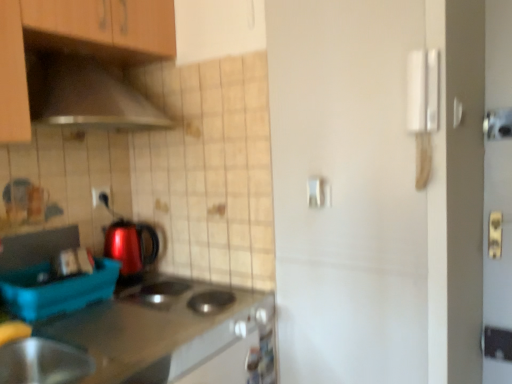
Question: Is metallic stainless steel countertop at lower left placed right next to matte black outlet at center?

Choices:
 (A) no
 (B) yes

Answer: (A)

Question: From a real-world perspective, is metallic stainless steel countertop at lower left positioned under matte black outlet at center based on gravity?

Choices:
 (A) yes
 (B) no

Answer: (A)

Question: Could you tell me if metallic stainless steel countertop at lower left is turned towards matte black outlet at center?

Choices:
 (A) yes
 (B) no

Answer: (B)

Question: From the image's perspective, is metallic stainless steel countertop at lower left on matte black outlet at center?

Choices:
 (A) yes
 (B) no

Answer: (B)

Question: Is metallic stainless steel countertop at lower left behind matte black outlet at center?

Choices:
 (A) yes
 (B) no

Answer: (B)

Question: From the image's perspective, relative to shiny plastic kettle at center-left, is white plastic door handle at upper right, the first door handle in the front-to-back sequence, above or below?

Choices:
 (A) below
 (B) above

Answer: (B)

Question: Based on their positions, is white plastic door handle at upper right, the first door handle in the front-to-back sequence, located to the left or right of shiny plastic kettle at center-left?

Choices:
 (A) left
 (B) right

Answer: (B)

Question: Is white plastic door handle at upper right, the 1th door handle positioned from the right, taller or shorter than shiny plastic kettle at center-left?

Choices:
 (A) short
 (B) tall

Answer: (B)

Question: Is white plastic door handle at upper right, the 2th door handle in the bottom-to-top sequence, inside or outside of shiny plastic kettle at center-left?

Choices:
 (A) outside
 (B) inside

Answer: (A)

Question: From a real-world perspective, is metallic stainless steel countertop at lower left physically located above or below white matte door handle at center, the 2th door handle positioned from the front?

Choices:
 (A) below
 (B) above

Answer: (A)

Question: Considering the positions of metallic stainless steel countertop at lower left and white matte door handle at center, the 1th door handle positioned from the bottom, in the image, is metallic stainless steel countertop at lower left wider or thinner than white matte door handle at center, the 1th door handle positioned from the bottom,?

Choices:
 (A) thin
 (B) wide

Answer: (B)

Question: Is metallic stainless steel countertop at lower left inside or outside of white matte door handle at center, the 2th door handle positioned from the front?

Choices:
 (A) inside
 (B) outside

Answer: (B)

Question: Relative to white matte door handle at center, the 1th door handle positioned from the bottom, is metallic stainless steel countertop at lower left in front or behind?

Choices:
 (A) behind
 (B) front

Answer: (B)

Question: Do you think shiny plastic kettle at center-left is within blue plastic container at lower left, or outside of it?

Choices:
 (A) outside
 (B) inside

Answer: (A)

Question: Considering the positions of shiny plastic kettle at center-left and blue plastic container at lower left in the image, is shiny plastic kettle at center-left wider or thinner than blue plastic container at lower left?

Choices:
 (A) wide
 (B) thin

Answer: (B)